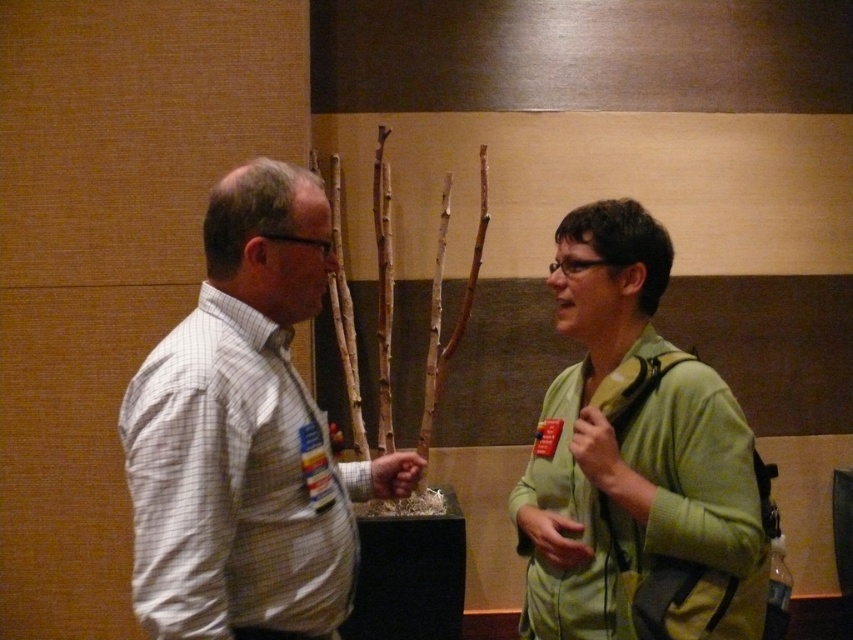
Is white checkered shirt at left to the left of green matte jacket at right from the viewer's perspective?

Indeed, white checkered shirt at left is positioned on the left side of green matte jacket at right.

In the scene shown: Is white checkered shirt at left bigger than green matte jacket at right?

Yes, white checkered shirt at left is bigger than green matte jacket at right.

Measure the distance between point (309, 259) and camera.

Point (309, 259) is 4.39 feet away from camera.

Identify the location of white checkered shirt at left. This screenshot has width=853, height=640. (245, 435).

Is green matte jacket at center to the right of white checkered shirt at left from the viewer's perspective?

Indeed, green matte jacket at center is positioned on the right side of white checkered shirt at left.

Is point (316, 429) positioned before point (286, 301)?

No, (316, 429) is behind (286, 301).

At what (x,y) coordinates should I click in order to perform the action: click on green matte jacket at center. Please return your answer as a coordinate pair (x, y). This screenshot has width=853, height=640. Looking at the image, I should click on (245, 435).

Is green matte jacket at center closer to the viewer compared to green matte jacket at right?

Yes.

I want to click on green matte jacket at center, so click(x=245, y=435).